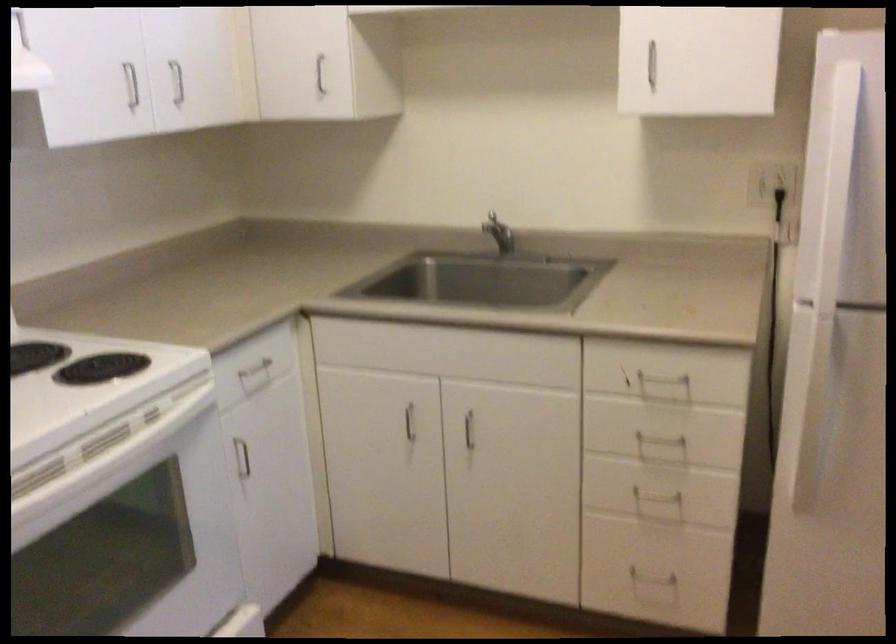
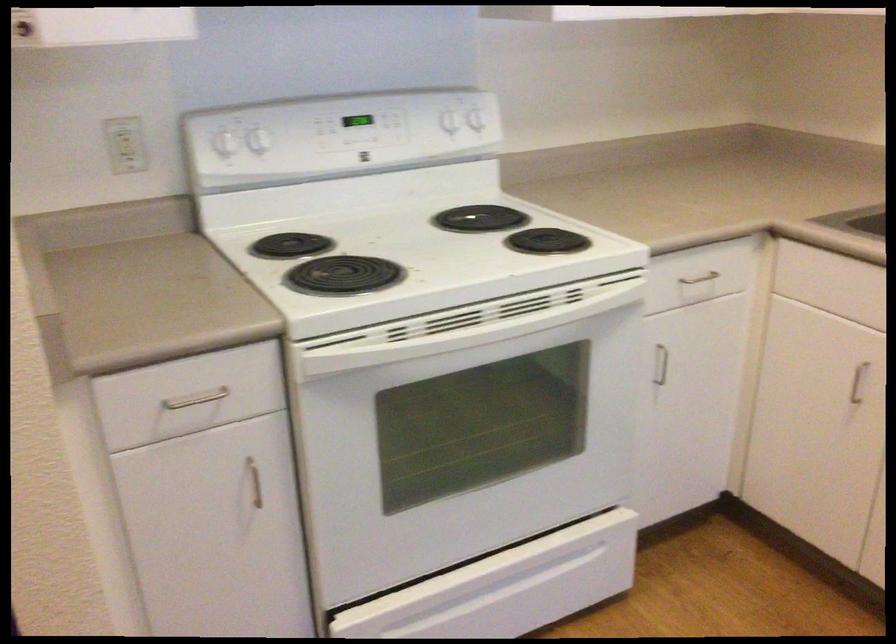
Question: The camera is either moving clockwise (left) or counter-clockwise (right) around the object. The first image is from the beginning of the video and the second image is from the end. Is the camera moving left or right when shooting the video?

Choices:
 (A) Left
 (B) Right

Answer: (B)